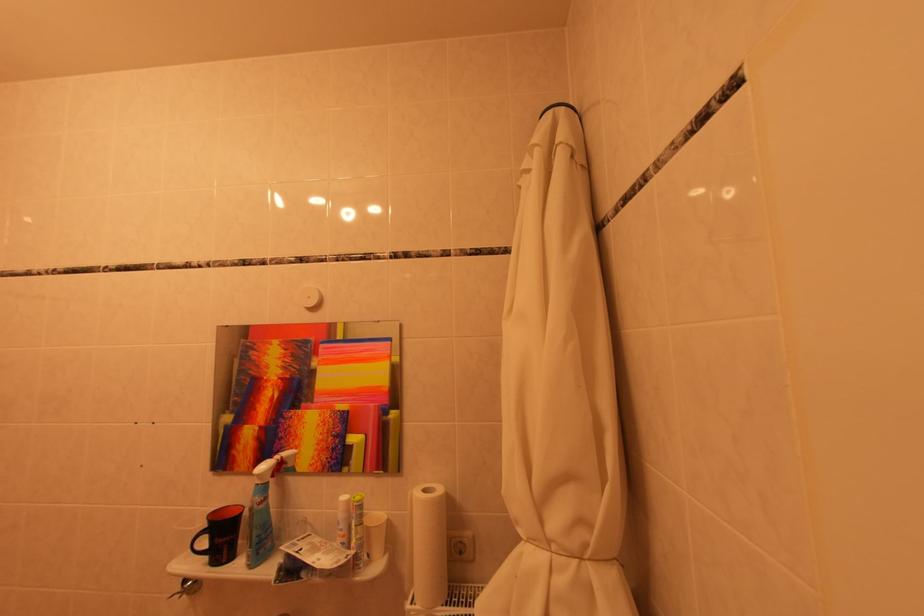
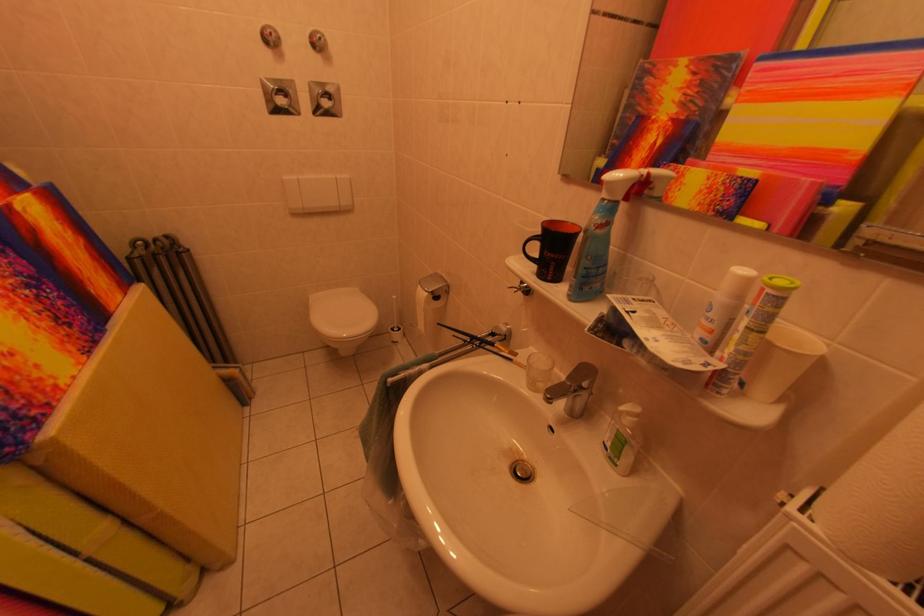
In the second image, find the point that corresponds to (224,477) in the first image.

(569, 184)